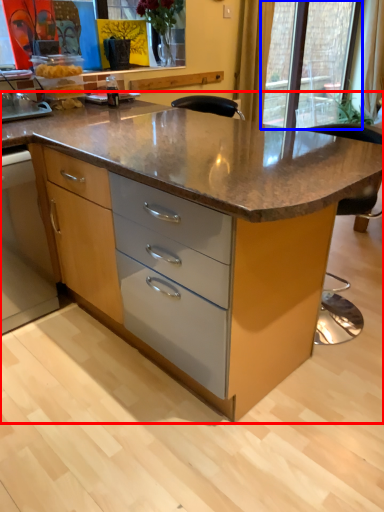
Question: Among these objects, which one is farthest to the camera, table (highlighted by a red box) or glass door (highlighted by a blue box)?

Choices:
 (A) table
 (B) glass door

Answer: (B)